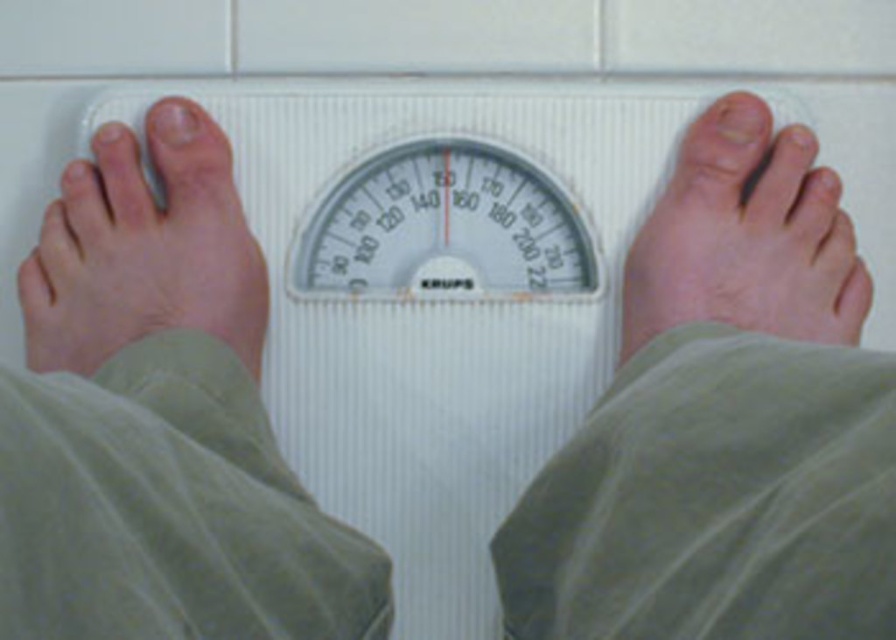
Which is more to the right, white plastic scale at center or skinny flesh-toned foot at left?

Positioned to the right is white plastic scale at center.

Which is in front, point (589, 305) or point (194, 208)?

Point (194, 208) is in front.

At what (x,y) coordinates should I click in order to perform the action: click on white plastic scale at center. Please return your answer as a coordinate pair (x, y). The width and height of the screenshot is (896, 640). Looking at the image, I should click on (449, 189).

The height and width of the screenshot is (640, 896). Identify the location of skinny flesh-toned foot at left. (144, 248).

Is white plastic scale at center thinner than skinny white foot at center?

No.

Is white plastic scale at center shorter than skinny white foot at center?

Yes.

At what (x,y) coordinates should I click in order to perform the action: click on white plastic scale at center. Please return your answer as a coordinate pair (x, y). This screenshot has width=896, height=640. Looking at the image, I should click on (449, 189).

Locate an element on the screen. The image size is (896, 640). white plastic scale at center is located at coordinates (449, 189).